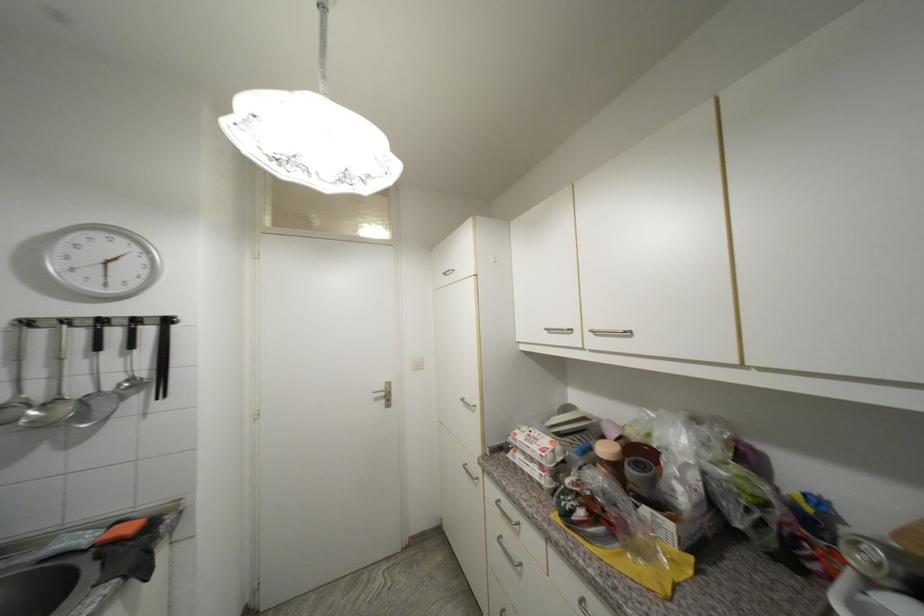
This screenshot has height=616, width=924. Describe the element at coordinates (611, 459) in the screenshot. I see `the brown glass bottle` at that location.